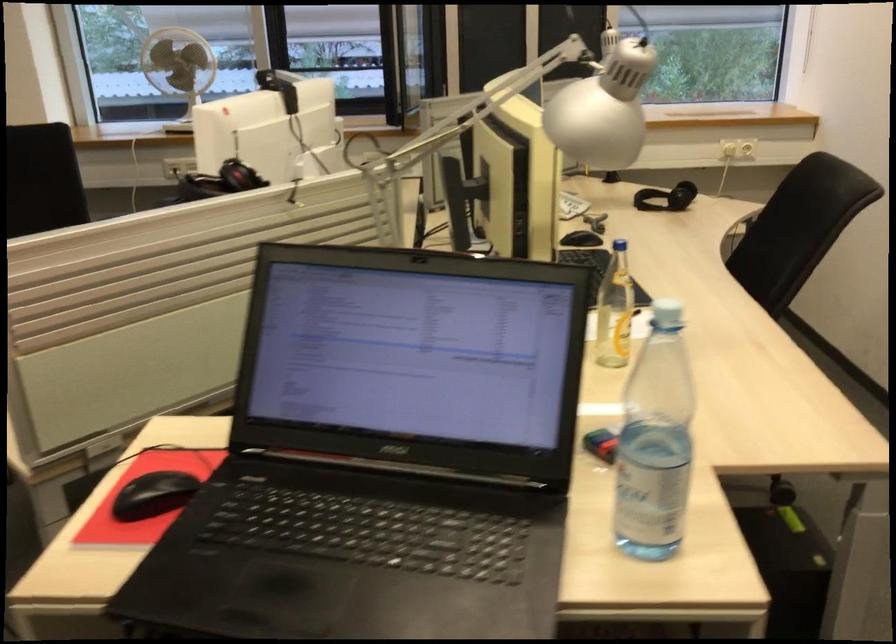
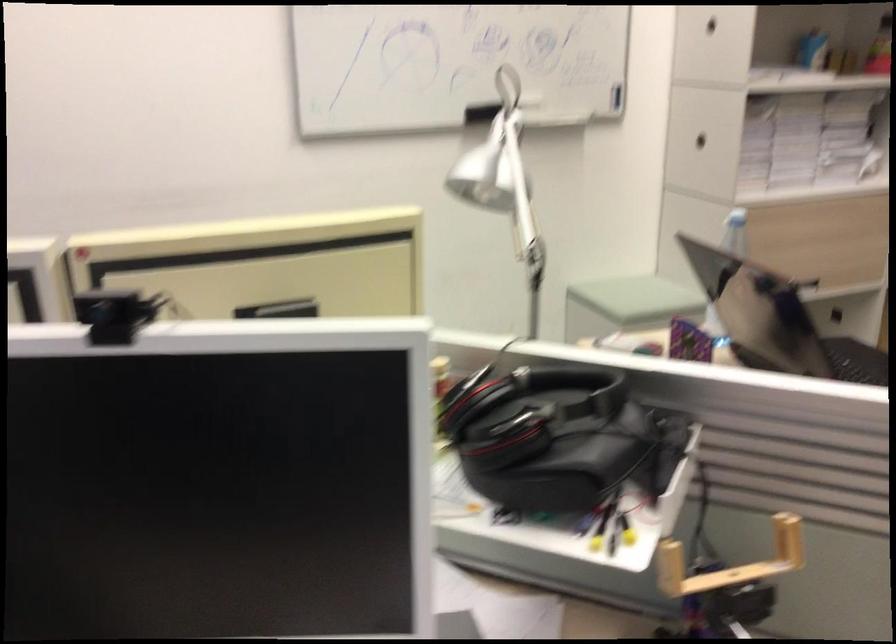
Locate, in the second image, the point that corresponds to the point at 152,377 in the first image.

(730, 562)